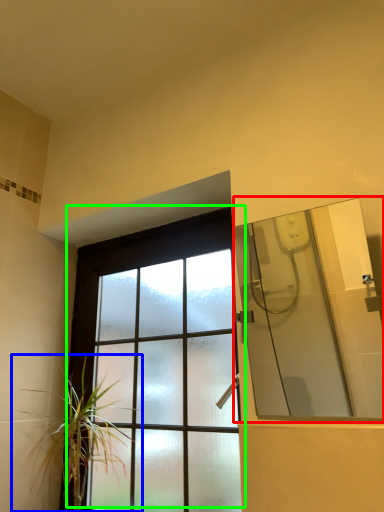
Question: Estimate the real-world distances between objects in this image. Which object is farther from mirror (highlighted by a red box), houseplant (highlighted by a blue box) or window (highlighted by a green box)?

Choices:
 (A) houseplant
 (B) window

Answer: (A)